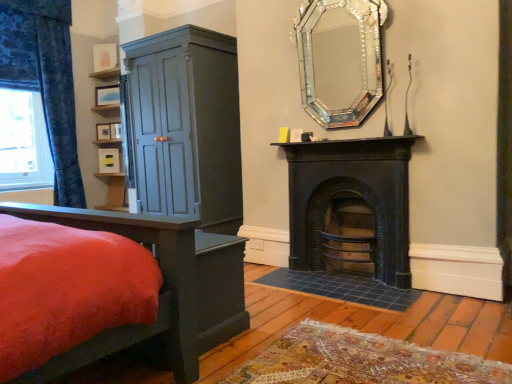
Question: Does blue floral fabric curtain at left contain white plastic power outlet at lower center?

Choices:
 (A) no
 (B) yes

Answer: (A)

Question: Is blue floral fabric curtain at left taller than white plastic power outlet at lower center?

Choices:
 (A) yes
 (B) no

Answer: (A)

Question: Can you confirm if blue floral fabric curtain at left is thinner than white plastic power outlet at lower center?

Choices:
 (A) yes
 (B) no

Answer: (B)

Question: Are blue floral fabric curtain at left and white plastic power outlet at lower center far apart?

Choices:
 (A) yes
 (B) no

Answer: (A)

Question: Is blue floral fabric curtain at left smaller than white plastic power outlet at lower center?

Choices:
 (A) no
 (B) yes

Answer: (A)

Question: From the image's perspective, relative to matte blue cabinet at left, is velvet red bed at lower left above or below?

Choices:
 (A) below
 (B) above

Answer: (A)

Question: Visually, is velvet red bed at lower left positioned to the left or to the right of matte blue cabinet at left?

Choices:
 (A) left
 (B) right

Answer: (A)

Question: From a real-world perspective, is velvet red bed at lower left physically located above or below matte blue cabinet at left?

Choices:
 (A) above
 (B) below

Answer: (B)

Question: Based on their sizes in the image, would you say velvet red bed at lower left is bigger or smaller than matte blue cabinet at left?

Choices:
 (A) small
 (B) big

Answer: (A)

Question: Is black cast iron fireplace at center, which appears as the 1th fireplace when ordered from the bottom, taller or shorter than matte yellow picture frame at center, which is counted as the 5th picture frame, starting from the top?

Choices:
 (A) short
 (B) tall

Answer: (B)

Question: In terms of width, does black cast iron fireplace at center, the 2th fireplace viewed from the top, look wider or thinner when compared to matte yellow picture frame at center, positioned as the first picture frame in bottom-to-top order?

Choices:
 (A) wide
 (B) thin

Answer: (A)

Question: Is black cast iron fireplace at center, the 2th fireplace viewed from the top, inside or outside of matte yellow picture frame at center, positioned as the first picture frame in bottom-to-top order?

Choices:
 (A) inside
 (B) outside

Answer: (B)

Question: Is black cast iron fireplace at center, which appears as the 1th fireplace when ordered from the bottom, in front of or behind matte yellow picture frame at center, positioned as the first picture frame in bottom-to-top order, in the image?

Choices:
 (A) behind
 (B) front

Answer: (B)

Question: Is point (220, 157) positioned closer to the camera than point (16, 13)?

Choices:
 (A) farther
 (B) closer

Answer: (B)

Question: In the image, is matte blue cabinet at left on the left side or the right side of blue floral fabric curtain at left?

Choices:
 (A) left
 (B) right

Answer: (B)